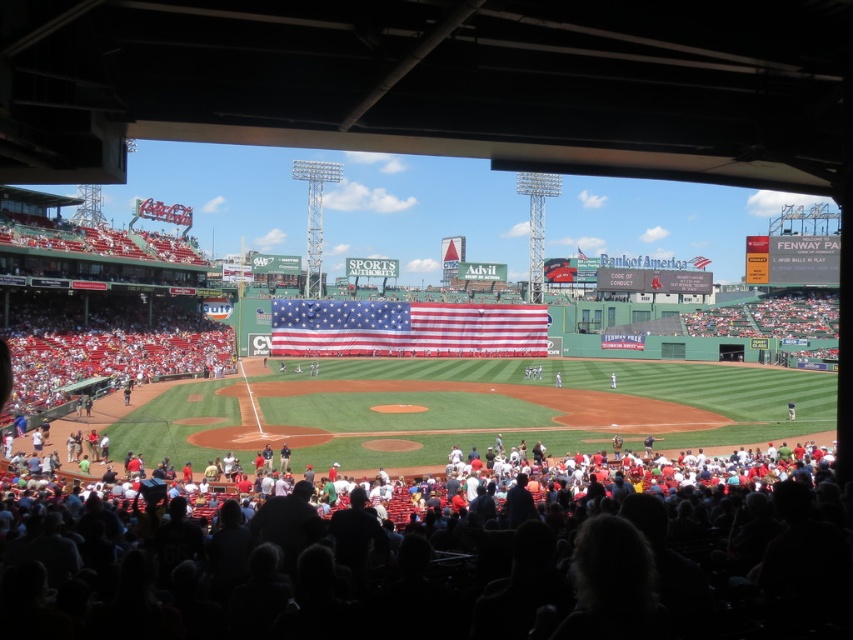
Does dark hair at lower center appear under white plastic scoreboard at upper right?

Correct, dark hair at lower center is located below white plastic scoreboard at upper right.

Who is positioned more to the right, dark hair at lower center or white plastic scoreboard at upper right?

white plastic scoreboard at upper right is more to the right.

Is point (117, 579) positioned in front of point (798, 273)?

Yes.

The image size is (853, 640). Find the location of `dark hair at lower center`. dark hair at lower center is located at coordinates (508, 566).

How far apart are american flag at center and white plastic scoreboard at upper right?

The distance of american flag at center from white plastic scoreboard at upper right is 194.67 feet.

Is american flag at center wider than white plastic scoreboard at upper right?

Yes.

The height and width of the screenshot is (640, 853). I want to click on american flag at center, so click(405, 328).

Which is in front, point (339, 618) or point (494, 321)?

Point (339, 618) is in front.

Does point (666, 598) come behind point (393, 355)?

No, it is not.

In order to click on dark hair at lower center in this screenshot , I will do `click(508, 566)`.